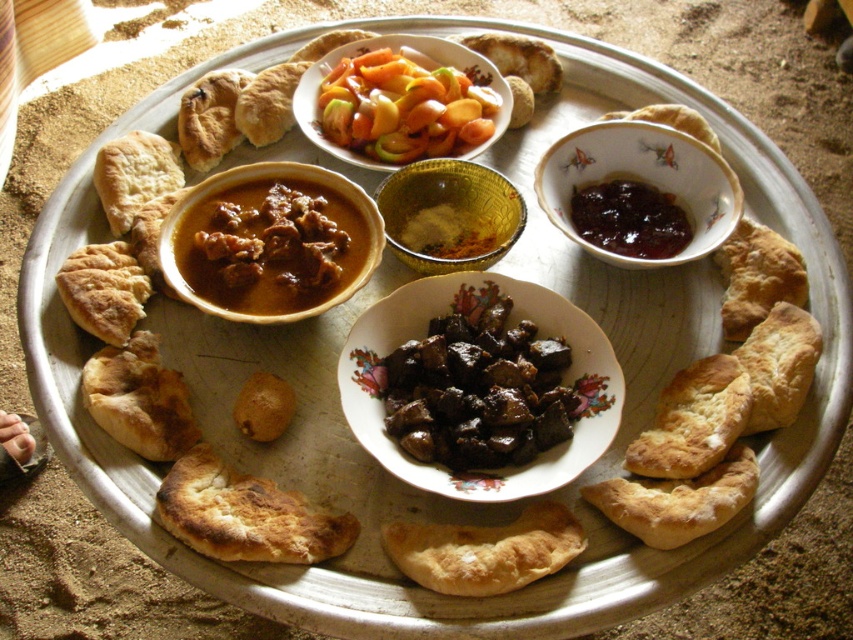
Question: Which point appears closest to the camera in this image?

Choices:
 (A) (235, 528)
 (B) (697, 177)

Answer: (A)

Question: Does golden brown crusty flatbread at lower left have a greater width compared to dark glossy jam at upper right?

Choices:
 (A) yes
 (B) no

Answer: (A)

Question: Which is nearer to the gold textured bowl at center?

Choices:
 (A) brown matte bowl at center
 (B) brown glazed bowl at center
 (C) translucent glass bowl at center

Answer: (A)

Question: Among these objects, which one is farthest from the camera?

Choices:
 (A) brown matte bowl at center
 (B) golden brown crusty flatbread at lower left

Answer: (A)

Question: Does brown matte bowl at center appear over golden brown crusty flatbread at lower left?

Choices:
 (A) yes
 (B) no

Answer: (A)

Question: Is dark brown glossy stew at center smaller than translucent glass bowl at center?

Choices:
 (A) no
 (B) yes

Answer: (B)